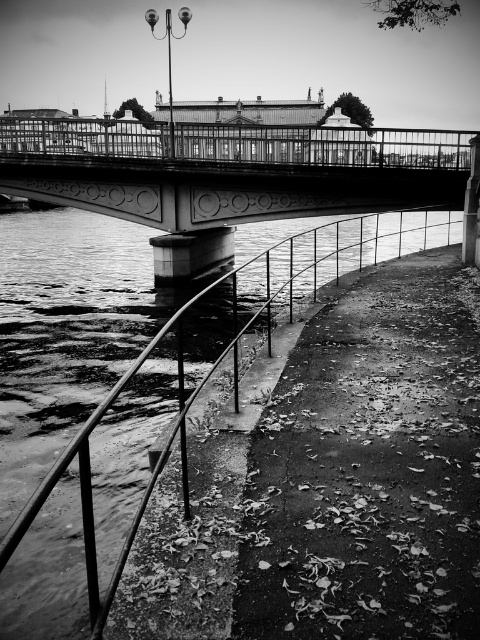
Question: Which point is farther from the camera taking this photo?

Choices:
 (A) (74, 337)
 (B) (15, 141)

Answer: (B)

Question: Is metal/rusty rail at lower left to the left of metallic bridge at center from the viewer's perspective?

Choices:
 (A) no
 (B) yes

Answer: (A)

Question: Among these points, which one is nearest to the camera?

Choices:
 (A) tap(396, 163)
 (B) tap(68, 337)

Answer: (B)

Question: Is metal/rusty rail at lower left closer to the viewer compared to metallic bridge at center?

Choices:
 (A) yes
 (B) no

Answer: (A)

Question: Can you confirm if metal/rusty rail at lower left is positioned below metallic bridge at center?

Choices:
 (A) no
 (B) yes

Answer: (B)